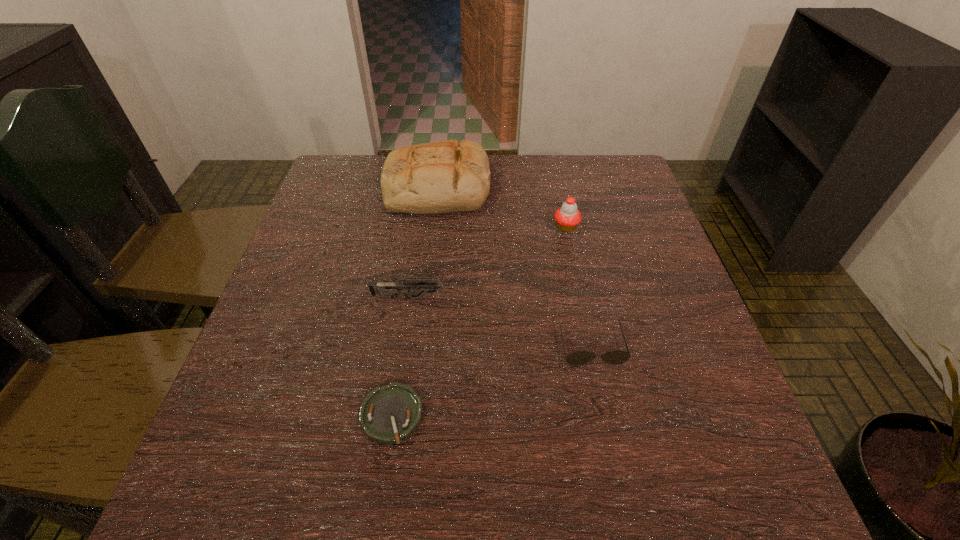
Locate an element on the screen. vacant space located aimed along the barrel of the third tallest object is located at coordinates (573, 298).

This screenshot has height=540, width=960. I want to click on vacant space situated 0.050m on the front-facing side of the fourth tallest object, so click(601, 390).

Locate an element on the screen. vacant area located on the right of the nearest object is located at coordinates (551, 416).

Find the location of `object that is at the far edge`. object that is at the far edge is located at coordinates (440, 177).

Find the location of `vacant space at the far edge of the desktop`. vacant space at the far edge of the desktop is located at coordinates (532, 157).

Where is `vacant area at the near edge`? vacant area at the near edge is located at coordinates (578, 515).

This screenshot has width=960, height=540. In the image, there is a desktop. In order to click on vacant space at the left edge in this screenshot , I will do `click(312, 265)`.

You are a GUI agent. You are given a task and a screenshot of the screen. Output one action in this format:
    pyautogui.click(x=<x>, y=<y>)
    Task: Click on the vacant space at the far left corner of the desktop
    
    Given the screenshot: What is the action you would take?
    pyautogui.click(x=326, y=196)

I want to click on free point at the far right corner, so click(x=617, y=154).

Image resolution: width=960 pixels, height=540 pixels. I want to click on vacant region between the tallest object and the fourth tallest object, so click(x=515, y=267).